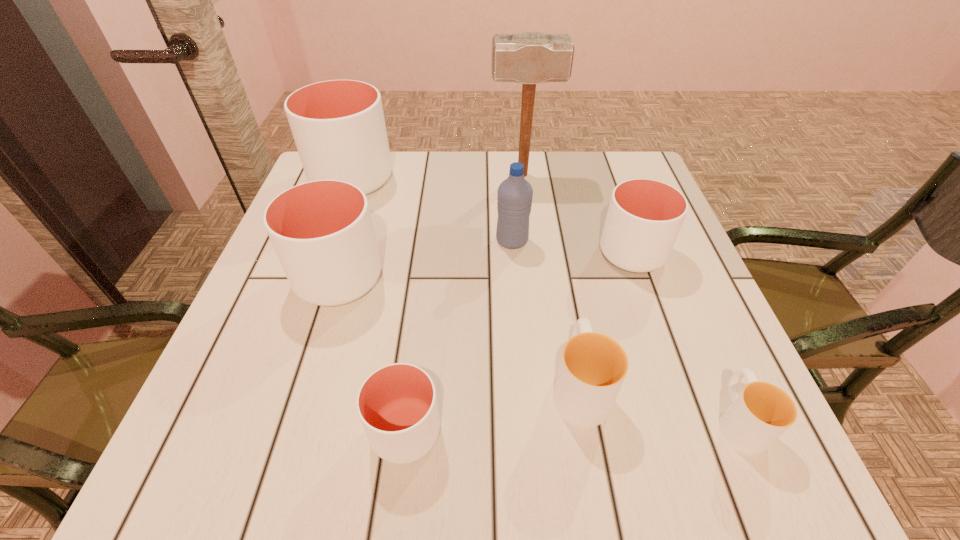
Locate an element on the screen. Image resolution: width=960 pixels, height=540 pixels. free area in between the third cup from left to right and the left yellow cup is located at coordinates (492, 409).

Image resolution: width=960 pixels, height=540 pixels. In order to click on free spot between the third cup from right to left and the mallet in this screenshot , I will do `click(551, 281)`.

At what (x,y) coordinates should I click in order to perform the action: click on empty space between the fifth shortest cup and the third cup from right to left. Please return your answer as a coordinate pair (x, y). The height and width of the screenshot is (540, 960). Looking at the image, I should click on (459, 332).

Where is `free area in between the fourth cup from left to right and the second white cup from right to left`? free area in between the fourth cup from left to right and the second white cup from right to left is located at coordinates (492, 409).

The height and width of the screenshot is (540, 960). I want to click on empty location between the second tallest cup and the shortest cup, so point(539,349).

Where is `vacant area between the second biggest white cup and the rightmost white cup`? The image size is (960, 540). vacant area between the second biggest white cup and the rightmost white cup is located at coordinates coord(486,266).

Identify which object is located as the second nearest to the tallest object. Please provide its 2D coordinates. Your answer should be formatted as a tuple, i.e. [(x, y)], where the tuple contains the x and y coordinates of a point satisfying the conditions above.

[(644, 217)]

Where is `object that stands as the closest to the tallest cup`? This screenshot has height=540, width=960. object that stands as the closest to the tallest cup is located at coordinates (322, 231).

Where is `cup that stands as the fourth closest to the nearest white cup`? The height and width of the screenshot is (540, 960). cup that stands as the fourth closest to the nearest white cup is located at coordinates (762, 412).

Locate an element on the screen. cup identified as the second closest to the tallest cup is located at coordinates (644, 217).